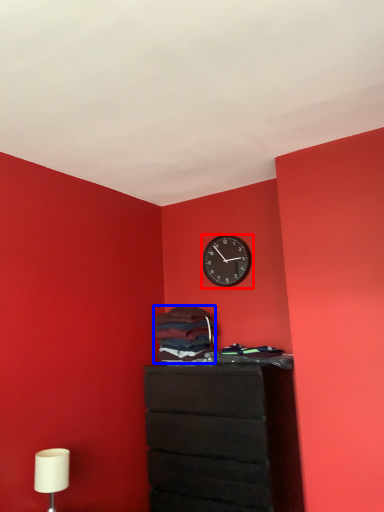
Question: Which of the following is the farthest to the observer, wall clock (highlighted by a red box) or laundry (highlighted by a blue box)?

Choices:
 (A) wall clock
 (B) laundry

Answer: (A)